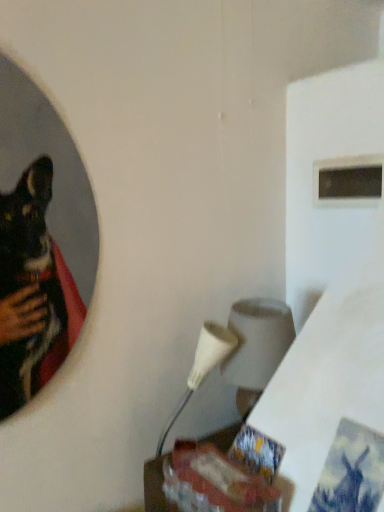
Question: From the image's perspective, is black matte window at upper right over white matte lampshade at center-right?

Choices:
 (A) yes
 (B) no

Answer: (A)

Question: Is black matte window at upper right thinner than white matte lampshade at center-right?

Choices:
 (A) yes
 (B) no

Answer: (A)

Question: Is black matte window at upper right at the right side of white matte lampshade at center-right?

Choices:
 (A) no
 (B) yes

Answer: (B)

Question: Considering the relative sizes of black matte window at upper right and white matte lampshade at center-right in the image provided, is black matte window at upper right smaller than white matte lampshade at center-right?

Choices:
 (A) yes
 (B) no

Answer: (A)

Question: Is black matte window at upper right at the left side of white matte lampshade at center-right?

Choices:
 (A) yes
 (B) no

Answer: (B)

Question: Is black matte window at upper right oriented towards white matte lampshade at center-right?

Choices:
 (A) no
 (B) yes

Answer: (A)

Question: Considering the relative sizes of wooden table at lower center and black matte window at upper right in the image provided, is wooden table at lower center shorter than black matte window at upper right?

Choices:
 (A) no
 (B) yes

Answer: (B)

Question: Does wooden table at lower center have a larger size compared to black matte window at upper right?

Choices:
 (A) yes
 (B) no

Answer: (B)

Question: Can you confirm if wooden table at lower center is wider than black matte window at upper right?

Choices:
 (A) no
 (B) yes

Answer: (B)

Question: Does wooden table at lower center have a greater height compared to black matte window at upper right?

Choices:
 (A) yes
 (B) no

Answer: (B)

Question: Is wooden table at lower center closer to camera compared to black matte window at upper right?

Choices:
 (A) yes
 (B) no

Answer: (A)

Question: Considering the relative positions of wooden table at lower center and black matte window at upper right in the image provided, is wooden table at lower center to the right of black matte window at upper right from the viewer's perspective?

Choices:
 (A) no
 (B) yes

Answer: (A)

Question: Considering the relative sizes of white matte lampshade at center-right and wooden table at lower center in the image provided, is white matte lampshade at center-right bigger than wooden table at lower center?

Choices:
 (A) no
 (B) yes

Answer: (B)